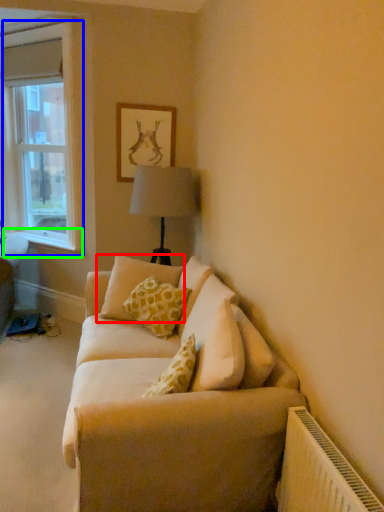
Question: Estimate the real-world distances between objects in this image. Which object is farther from pillow (highlighted by a red box), window (highlighted by a blue box) or window sill (highlighted by a green box)?

Choices:
 (A) window
 (B) window sill

Answer: (A)